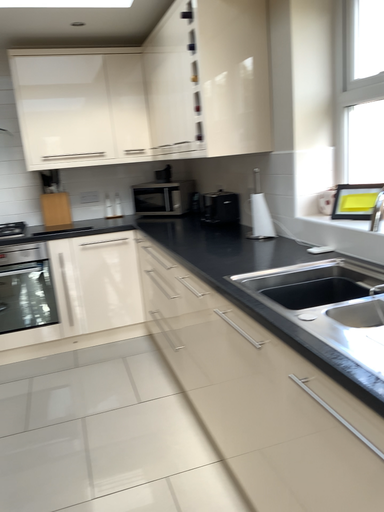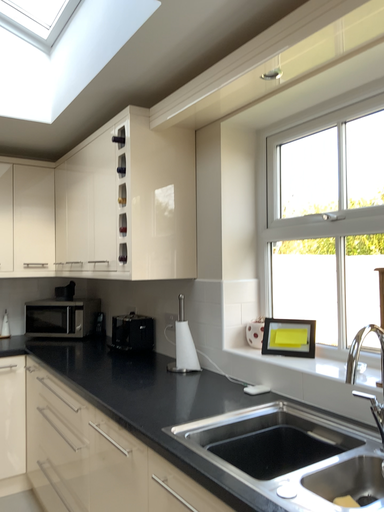
Question: How did the camera likely rotate when shooting the video?

Choices:
 (A) rotated right
 (B) rotated left

Answer: (A)